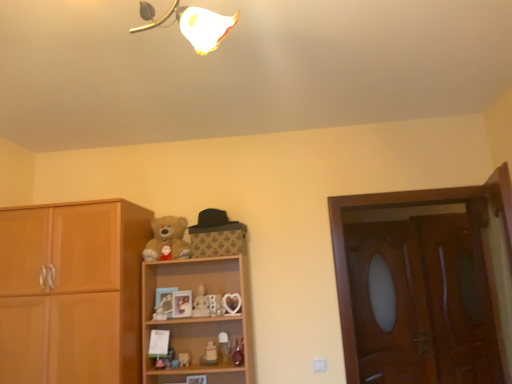
How much space does matte plastic teddy bear at center, the 5th toy when ordered from right to left, occupy vertically?

2.81 inches.

The height and width of the screenshot is (384, 512). Find the location of `matte plastic teddy bear at center, marked as the first toy in a left-to-right arrangement`. matte plastic teddy bear at center, marked as the first toy in a left-to-right arrangement is located at coordinates (160, 313).

Identify the location of bleached cotton teddy bear at center. point(167,239).

At what (x,y) coordinates should I click in order to perform the action: click on white glossy figurine at center, arranged as the fourth toy when viewed from the left. Please return your answer as a coordinate pair (x, y). This screenshot has height=384, width=512. Looking at the image, I should click on (210, 354).

This screenshot has width=512, height=384. I want to click on screen door that is the 2nd one below the bleached cotton teddy bear at center (from a real-world perspective), so (458, 301).

Which object is positioned more to the right, brown wooden screen door at right, the 1th screen door positioned from the right, or bleached cotton teddy bear at center?

brown wooden screen door at right, the 1th screen door positioned from the right.

From a real-world perspective, which is physically below, brown wooden screen door at right, the 1th screen door positioned from the right, or bleached cotton teddy bear at center?

In real-world perspective, brown wooden screen door at right, the 1th screen door positioned from the right, is lower.

From the image's perspective, relative to matte plastic cat at center, marked as the 4th toy in a right-to-left arrangement, is bleached cotton teddy bear at center above or below?

From the image's perspective, bleached cotton teddy bear at center appears above matte plastic cat at center, marked as the 4th toy in a right-to-left arrangement.

Does bleached cotton teddy bear at center have a lesser width compared to matte plastic cat at center, positioned as the second toy in left-to-right order?

No.

Which object is positioned more to the left, bleached cotton teddy bear at center or matte plastic cat at center, positioned as the second toy in left-to-right order?

bleached cotton teddy bear at center is more to the left.

Does bleached cotton teddy bear at center have a smaller size compared to matte plastic cat at center, positioned as the second toy in left-to-right order?

Incorrect, bleached cotton teddy bear at center is not smaller in size than matte plastic cat at center, positioned as the second toy in left-to-right order.

What's the angular difference between brown wooden screen door at right, the 1th screen door positioned from the right, and matte plastic cat at center, positioned as the second toy in left-to-right order,'s facing directions?

The angle between the facing direction of brown wooden screen door at right, the 1th screen door positioned from the right, and the facing direction of matte plastic cat at center, positioned as the second toy in left-to-right order, is 2.25 degrees.

From a real-world perspective, is brown wooden screen door at right, the 1th screen door positioned from the right, on top of matte plastic cat at center, marked as the 4th toy in a right-to-left arrangement?

Yes.

There is a matte plastic cat at center, marked as the 4th toy in a right-to-left arrangement. Identify the location of the 1st screen door above it (from a real-world perspective). (458, 301).

Does point (431, 270) appear closer or farther from the camera than point (188, 358)?

Point (431, 270) is farther from the camera than point (188, 358).

Does wooden screen door at right, the 1th screen door positioned from the left, come in front of bleached cotton teddy bear at center?

No, it is behind bleached cotton teddy bear at center.

Considering the sizes of objects wooden screen door at right, marked as the 2th screen door in a right-to-left arrangement, and bleached cotton teddy bear at center in the image provided, who is wider, wooden screen door at right, marked as the 2th screen door in a right-to-left arrangement, or bleached cotton teddy bear at center?

Wider between the two is bleached cotton teddy bear at center.

How much distance is there between wooden screen door at right, the 1th screen door positioned from the left, and bleached cotton teddy bear at center?

wooden screen door at right, the 1th screen door positioned from the left, and bleached cotton teddy bear at center are 6.07 feet apart.

Looking at the image, does wooden screen door at right, the 1th screen door positioned from the left, seem bigger or smaller compared to bleached cotton teddy bear at center?

wooden screen door at right, the 1th screen door positioned from the left, is bigger than bleached cotton teddy bear at center.

Between wooden door at right and matte plastic teddy bear at center, marked as the first toy in a left-to-right arrangement, which one has smaller size?

With smaller size is matte plastic teddy bear at center, marked as the first toy in a left-to-right arrangement.

Which of these two, wooden door at right or matte plastic teddy bear at center, marked as the first toy in a left-to-right arrangement, is thinner?

matte plastic teddy bear at center, marked as the first toy in a left-to-right arrangement.

Are wooden door at right and matte plastic teddy bear at center, the 5th toy when ordered from right to left, located far from each other?

Indeed, wooden door at right is not near matte plastic teddy bear at center, the 5th toy when ordered from right to left.

From a real-world perspective, starting from the wooden door at right, which toy is the 1st one below it? Please provide its 2D coordinates.

[(160, 313)]

The image size is (512, 384). I want to click on the 1st toy counting from the right of the bleached cotton teddy bear at center, so click(x=184, y=359).

Is matte plastic cat at center, positioned as the second toy in left-to-right order, wider or thinner than bleached cotton teddy bear at center?

In the image, matte plastic cat at center, positioned as the second toy in left-to-right order, appears to be more narrow than bleached cotton teddy bear at center.

From a real-world perspective, who is located lower, matte plastic cat at center, positioned as the second toy in left-to-right order, or bleached cotton teddy bear at center?

matte plastic cat at center, positioned as the second toy in left-to-right order.

How many degrees apart are the facing directions of matte plastic cat at center, positioned as the second toy in left-to-right order, and bleached cotton teddy bear at center?

The facing directions of matte plastic cat at center, positioned as the second toy in left-to-right order, and bleached cotton teddy bear at center are 1.88 degrees apart.

Is brown wooden screen door at right, the 1th screen door positioned from the right, surrounded by wooden shelf at center?

That's incorrect, brown wooden screen door at right, the 1th screen door positioned from the right, is not inside wooden shelf at center.

How many degrees apart are the facing directions of wooden shelf at center and brown wooden screen door at right, the second screen door positioned from the left?

There is a 1.73-degree angle between the facing directions of wooden shelf at center and brown wooden screen door at right, the second screen door positioned from the left.

Which of these two, wooden shelf at center or brown wooden screen door at right, the 1th screen door positioned from the right, is bigger?

wooden shelf at center.

Is wooden shelf at center at the left side of brown wooden screen door at right, the second screen door positioned from the left?

Indeed, wooden shelf at center is positioned on the left side of brown wooden screen door at right, the second screen door positioned from the left.

Which screen door is the 2nd one when counting from the back of the bleached cotton teddy bear at center? Please provide its 2D coordinates.

[(458, 301)]

Which toy is the 1st one when counting from the right side of the bleached cotton teddy bear at center? Please provide its 2D coordinates.

[(184, 359)]

Which object lies nearer to the anchor point matte plastic toy at center, positioned as the fifth toy in left-to-right order, wooden cabinet at left or matte plastic teddy bear at center, marked as the first toy in a left-to-right arrangement?

matte plastic teddy bear at center, marked as the first toy in a left-to-right arrangement, is positioned closer to the anchor matte plastic toy at center, positioned as the fifth toy in left-to-right order.

When comparing their distances from wooden screen door at right, the 1th screen door positioned from the left, does white glossy figurine at center, arranged as the fourth toy when viewed from the left, or brown wooden screen door at right, the second screen door positioned from the left, seem closer?

Among the two, brown wooden screen door at right, the second screen door positioned from the left, is located nearer to wooden screen door at right, the 1th screen door positioned from the left.

Based on their spatial positions, is wooden screen door at right, marked as the 2th screen door in a right-to-left arrangement, or wooden door at right further from bleached cotton teddy bear at center?

The object further to bleached cotton teddy bear at center is wooden door at right.

When comparing their distances from wooden cabinet at left, does wooden shelf at center or matte plastic cat at center, marked as the 4th toy in a right-to-left arrangement, seem further?

matte plastic cat at center, marked as the 4th toy in a right-to-left arrangement.

When comparing their distances from brown wooden screen door at right, the 1th screen door positioned from the right, does bleached cotton teddy bear at center or matte plastic cat at center, marked as the 4th toy in a right-to-left arrangement, seem closer?

bleached cotton teddy bear at center.

Which object lies further to the anchor point wooden shelf at center, bleached cotton teddy bear at center or wooden cabinet at left?

Among the two, wooden cabinet at left is located further to wooden shelf at center.

From the image, which object appears to be nearer to brown wooden screen door at right, the 1th screen door positioned from the right, wooden door at right or matte plastic teddy bear at center, the 5th toy when ordered from right to left?

Based on the image, wooden door at right appears to be nearer to brown wooden screen door at right, the 1th screen door positioned from the right.

Considering their positions, is white glossy figurine at center, arranged as the fourth toy when viewed from the left, positioned closer to matte plastic toy at center, positioned as the fifth toy in left-to-right order, than matte plastic cat at center, marked as the 4th toy in a right-to-left arrangement?

Among the two, white glossy figurine at center, arranged as the fourth toy when viewed from the left, is located nearer to matte plastic toy at center, positioned as the fifth toy in left-to-right order.

This screenshot has width=512, height=384. In order to click on shelf between matte plastic cat at center, marked as the 4th toy in a right-to-left arrangement, and matte plastic toy at center, positioned as the fifth toy in left-to-right order in this screenshot , I will do `click(197, 317)`.

Locate an element on the screen. This screenshot has height=384, width=512. screen door situated between white glossy figurine at center, arranged as the fourth toy when viewed from the left, and brown wooden screen door at right, the 1th screen door positioned from the right, from left to right is located at coordinates (389, 304).

Identify the location of screen door between matte plastic toy at center, positioned as the fifth toy in left-to-right order, and brown wooden screen door at right, the second screen door positioned from the left. (389, 304).

Locate an element on the screen. The width and height of the screenshot is (512, 384). door between white glossy figurine at center, arranged as the fourth toy when viewed from the left, and brown wooden screen door at right, the 1th screen door positioned from the right is located at coordinates (426, 284).